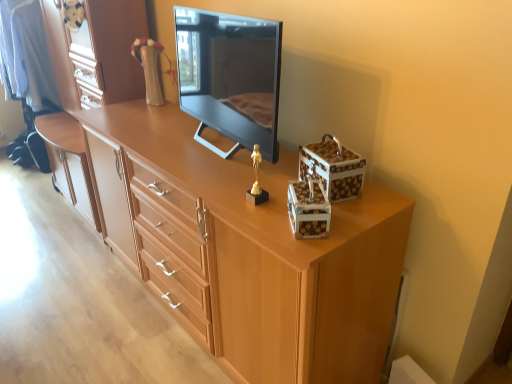
The height and width of the screenshot is (384, 512). I want to click on unoccupied region to the right of gold metallic statue at center, so click(x=286, y=206).